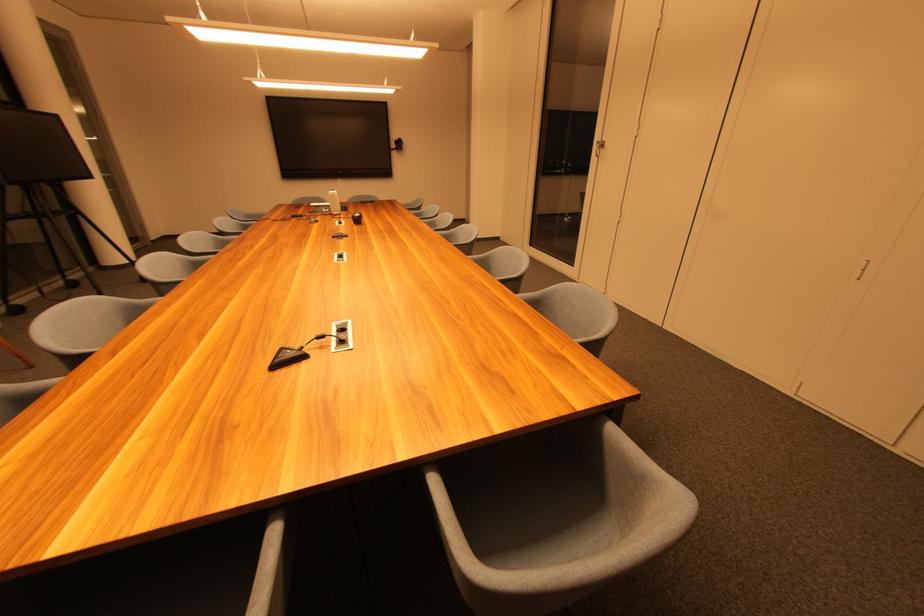
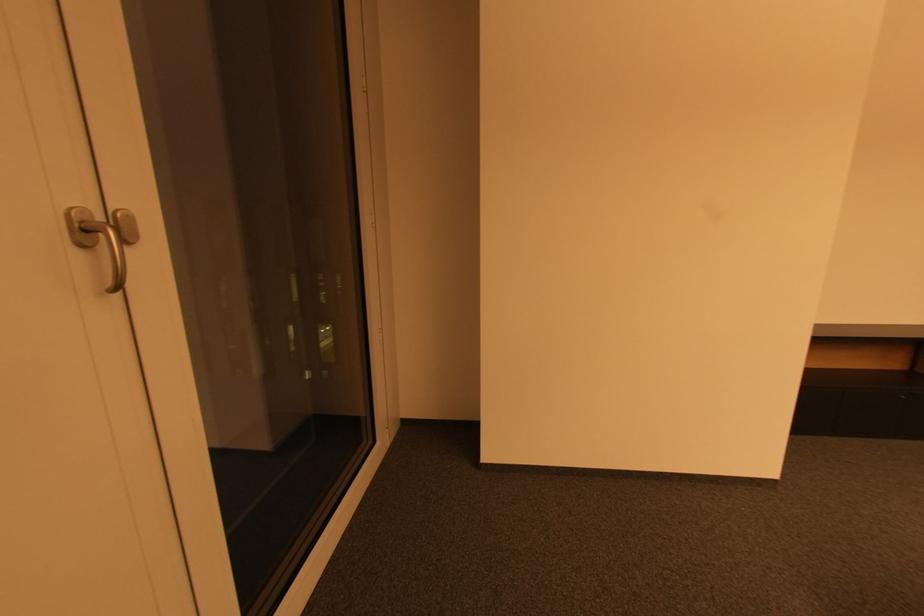
Based on the continuous images, in which direction is the camera rotating?

The camera rotated toward left-down.